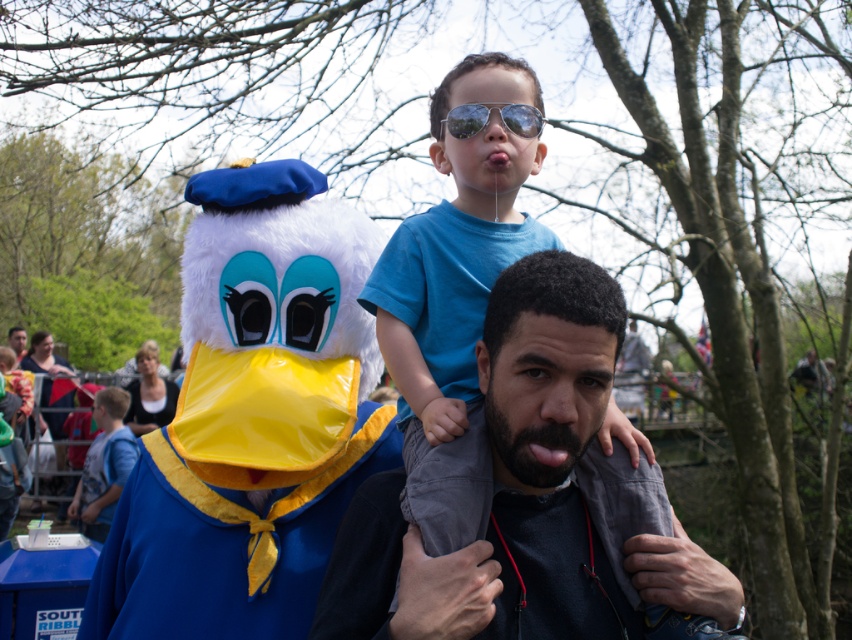
The image size is (852, 640). Find the location of `blue cotton shirt at center`. blue cotton shirt at center is located at coordinates (452, 321).

Who is more forward, (494, 353) or (519, 106)?

Point (494, 353) is more forward.

Is dark gray fabric at center thinner than reflective plastic goggles at center?

No, dark gray fabric at center is not thinner than reflective plastic goggles at center.

Locate an element on the screen. dark gray fabric at center is located at coordinates (504, 483).

Does dark gray fabric at center lie behind blue cotton shirt at center?

No, it is not.

Does dark gray fabric at center have a greater height compared to blue cotton shirt at center?

No.

Who is more forward, (447, 620) or (487, 148)?

Point (447, 620) is in front.

What are the coordinates of `dark gray fabric at center` in the screenshot? It's located at (504, 483).